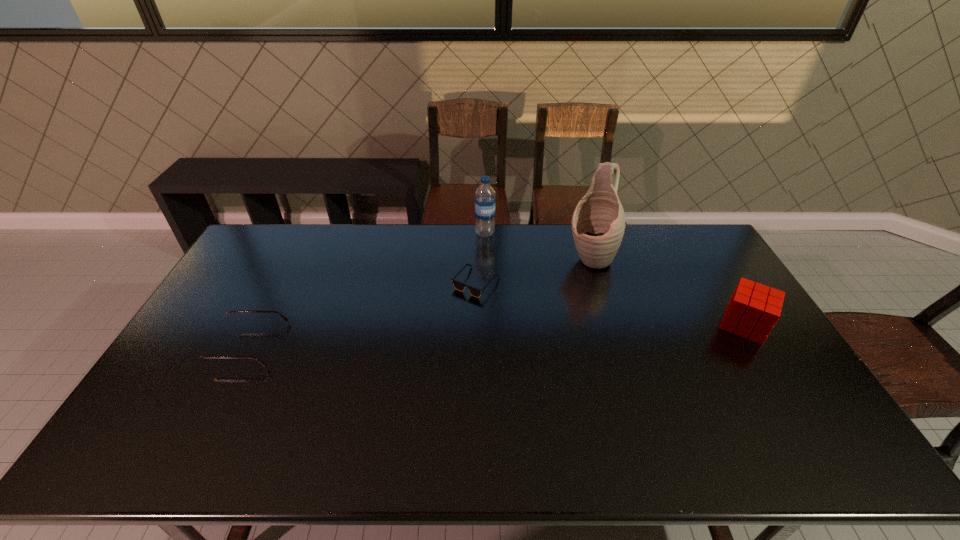
Image resolution: width=960 pixels, height=540 pixels. Identify the location of object that is the third closest to the spectacles. [x=598, y=222].

Identify the location of free space that satisfies the following two spatial constraints: 1. on the front side of the rightmost object; 2. on the right side of the shortest object. (475, 325).

What are the coordinates of `free location that satisfies the following two spatial constraints: 1. on the front side of the tallest object; 2. on the right side of the water bottle` in the screenshot? It's located at (485, 259).